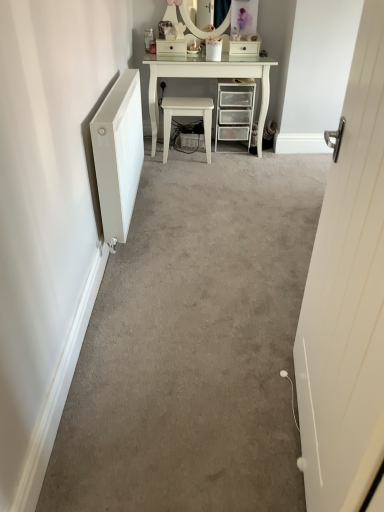
The image size is (384, 512). Find the location of `free space to the back side of white wooden door at right`. free space to the back side of white wooden door at right is located at coordinates (242, 346).